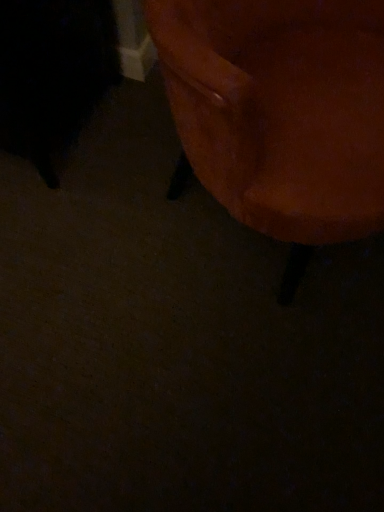
Locate an element on the screen. This screenshot has width=384, height=512. matte orange chair at lower right is located at coordinates (281, 113).

Describe the element at coordinates (281, 113) in the screenshot. I see `matte orange chair at lower right` at that location.

At what (x,y) coordinates should I click in order to perform the action: click on matte orange chair at lower right. Please return your answer as a coordinate pair (x, y). Looking at the image, I should click on (281, 113).